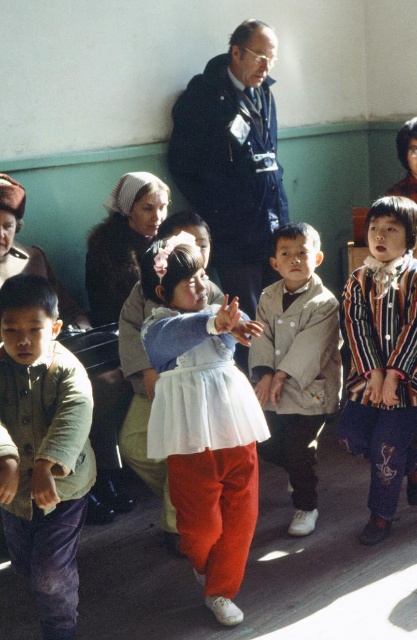
You are a photographer trying to capture a group photo of the matte green jacket at lower left and the striped fabric shirt at center. Since you want to ensure both subjects are clearly visible, which subject should you focus on to avoid blurriness due to their size in the frame?

The matte green jacket at lower left is narrower than the striped fabric shirt at center, so you should focus on the matte green jacket at lower left to ensure it is sharp since smaller subjects can be more challenging to focus on properly.

You are a photographer standing in the classroom and want to take a photo of both the point at (x=230, y=92) and the point at (x=281, y=244). Which point is closer to you?

Point at (x=230, y=92) is closer to you than the point at (x=281, y=244) because it is further to the viewer.